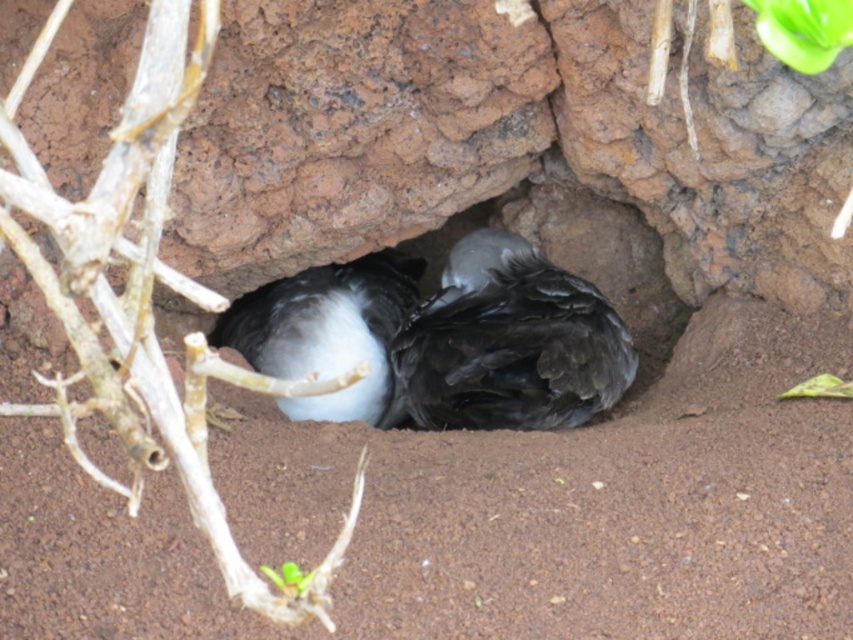
Question: Can you confirm if black matte bird at center is smaller than white fluffy bird at center?

Choices:
 (A) yes
 (B) no

Answer: (B)

Question: Estimate the real-world distances between objects in this image. Which object is farther from the black matte bird at center?

Choices:
 (A) white fluffy bird at center
 (B) brown woody branch at left
 (C) smooth rock hole at center

Answer: (B)

Question: Among these points, which one is farthest from the camera?

Choices:
 (A) (236, 328)
 (B) (178, 435)

Answer: (A)

Question: Can you confirm if brown woody branch at left is thinner than white fluffy bird at center?

Choices:
 (A) no
 (B) yes

Answer: (A)

Question: Which point is closer to the camera?

Choices:
 (A) (281, 410)
 (B) (637, 257)
 (C) (534, 403)

Answer: (C)

Question: Is brown woody branch at left closer to the viewer compared to smooth rock hole at center?

Choices:
 (A) yes
 (B) no

Answer: (A)